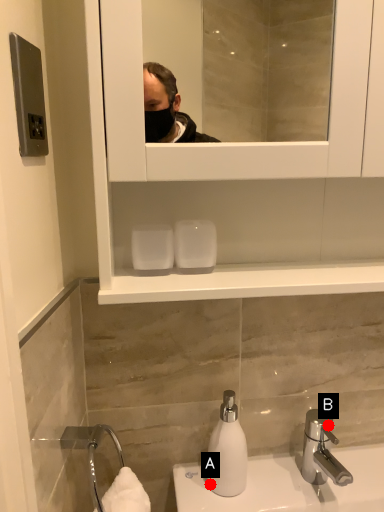
Question: Two points are circled on the image, labeled by A and B beside each circle. Among these points, which one is nearest to the camera?

Choices:
 (A) A is closer
 (B) B is closer

Answer: (A)